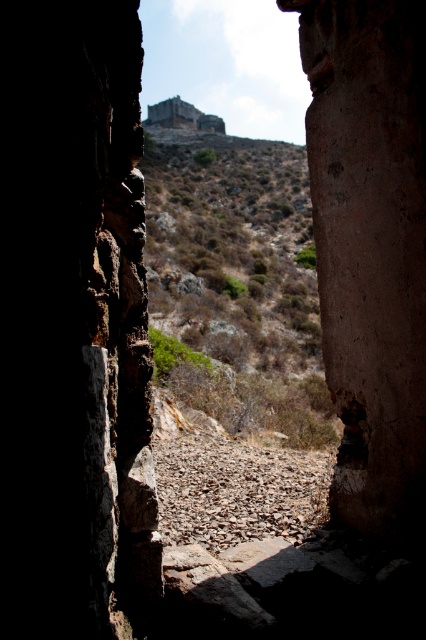
Can you confirm if smooth stone hole at center is smaller than rustic stone ruins at upper center?

Yes.

This screenshot has width=426, height=640. What do you see at coordinates (351, 429) in the screenshot? I see `smooth stone hole at center` at bounding box center [351, 429].

The height and width of the screenshot is (640, 426). In order to click on smooth stone hole at center in this screenshot , I will do `click(351, 429)`.